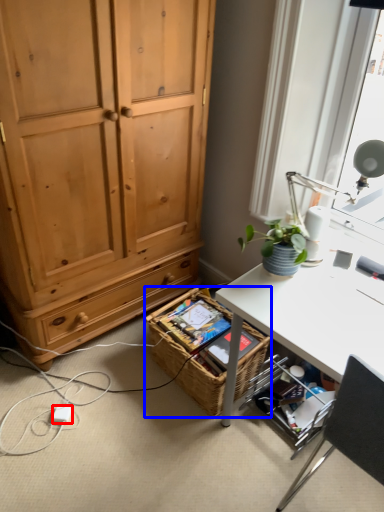
Question: Which point is closer to the camera, power outlet (highlighted by a red box) or picnic basket (highlighted by a blue box)?

Choices:
 (A) power outlet
 (B) picnic basket

Answer: (B)